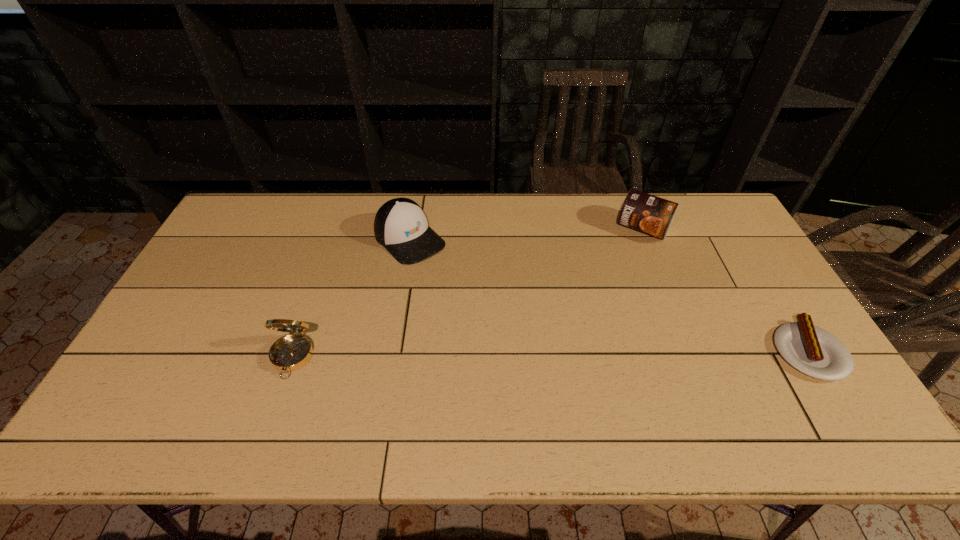
Identify the location of vacant space located on the front panel of the third object from right to left. The width and height of the screenshot is (960, 540). (469, 296).

The width and height of the screenshot is (960, 540). I want to click on free spot located on the front panel of the third object from right to left, so click(480, 307).

This screenshot has width=960, height=540. I want to click on can that is positioned at the far edge, so click(647, 213).

The height and width of the screenshot is (540, 960). What are the coordinates of `cap at the far edge` in the screenshot? It's located at (400, 226).

Where is `compass that is positioned at the near edge`? The width and height of the screenshot is (960, 540). compass that is positioned at the near edge is located at coordinates (291, 352).

Image resolution: width=960 pixels, height=540 pixels. Find the location of `sausage located in the near edge section of the desktop`. sausage located in the near edge section of the desktop is located at coordinates (814, 351).

Find the location of `object at the right edge`. object at the right edge is located at coordinates (814, 351).

I want to click on object at the near right corner, so click(x=814, y=351).

Locate an element on the screen. The height and width of the screenshot is (540, 960). free spot at the far edge of the desktop is located at coordinates (491, 219).

Image resolution: width=960 pixels, height=540 pixels. In order to click on vacant space at the near edge in this screenshot , I will do `click(407, 387)`.